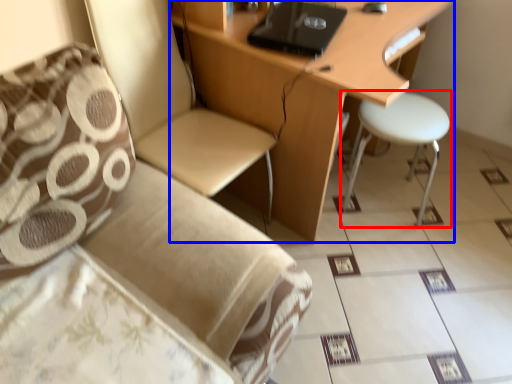
Question: Which object appears farthest to the camera in this image, stool (highlighted by a red box) or desk (highlighted by a blue box)?

Choices:
 (A) stool
 (B) desk

Answer: (A)